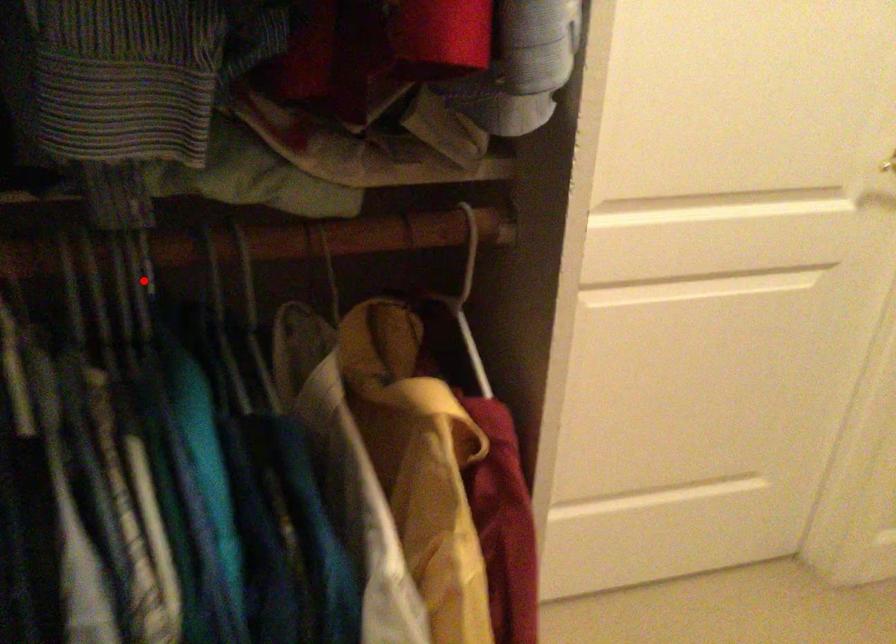
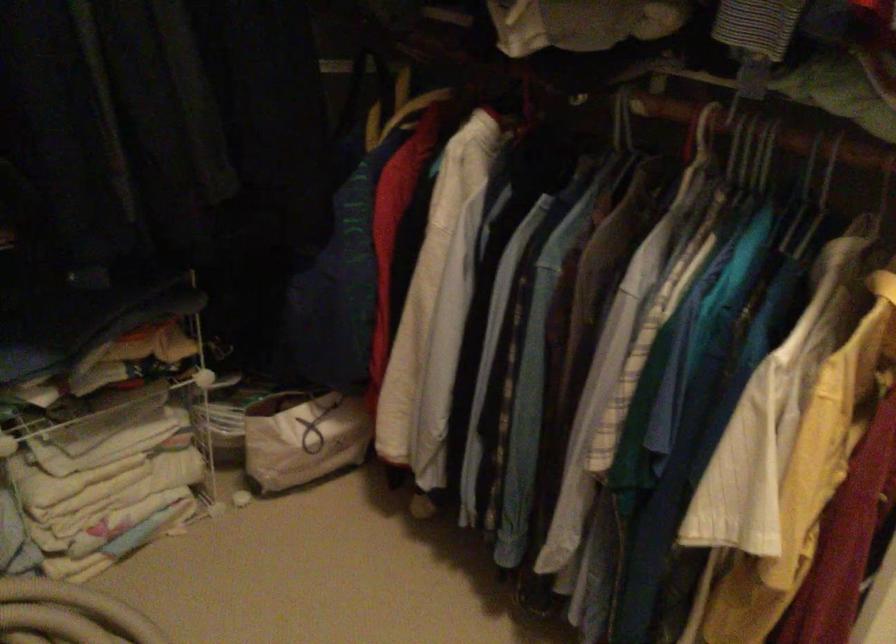
Question: I am providing you with two images of the same scene from different viewpoints. Given a red point in image1, look at the same physical point in image2. Is it:

Choices:
 (A) Closer to the viewpoint
 (B) Farther from the viewpoint

Answer: (B)